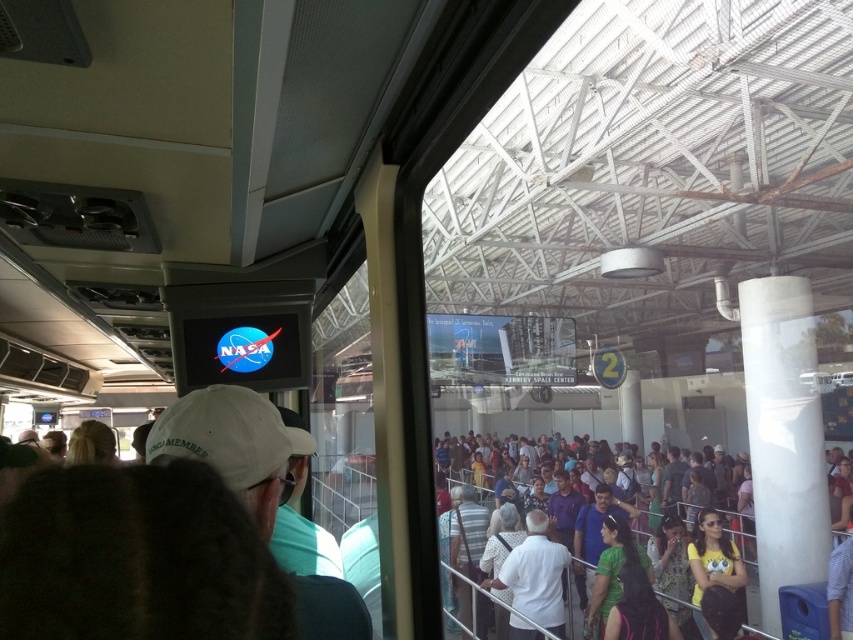
At what (x,y) coordinates should I click in order to perform the action: click on white fabric cap at center. Please return your answer as a coordinate pair (x, y). Looking at the image, I should click on (260, 492).

Is point (260, 532) farther from viewer compared to point (544, 608)?

No.

The height and width of the screenshot is (640, 853). Identify the location of white fabric cap at center. (260, 492).

Which is more to the left, white matte shirt at center or multicolored casual attire at center?

Positioned to the left is white matte shirt at center.

Is white matte shirt at center above multicolored casual attire at center?

Indeed, white matte shirt at center is positioned over multicolored casual attire at center.

Which is behind, point (514, 588) or point (750, 589)?

The point (750, 589) is more distant.

This screenshot has width=853, height=640. I want to click on white matte shirt at center, so [535, 573].

Is point (334, 547) more distant than point (636, 531)?

No, (334, 547) is in front of (636, 531).

Find the location of a particular element. white fabric cap at center is located at coordinates (260, 492).